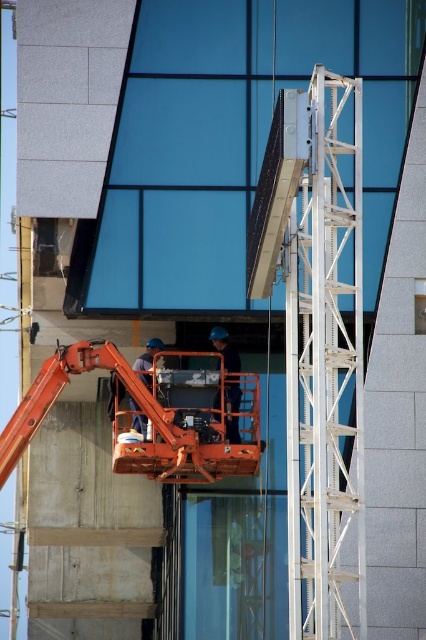
You are a construction worker standing at the base of the building and need to reach the top of the white metallic ladder at right. Which direction should you move to get there?

You should move to the right to reach the top of the white metallic ladder at right since it is located at the right side of the scene.

You are a safety inspector observing the construction site. You notice the white metallic ladder at right and the orange fabric construction worker at center. Which object is located to the right of the other?

The white metallic ladder at right is positioned on the right side of orange fabric construction worker at center.

You are a safety inspector assessing the construction site depicted in the image. You notice the white metallic ladder at right and the orange fabric construction worker at center. Which object is positioned closer to your viewpoint?

The white metallic ladder at right is closer to the viewer than the orange fabric construction worker at center.